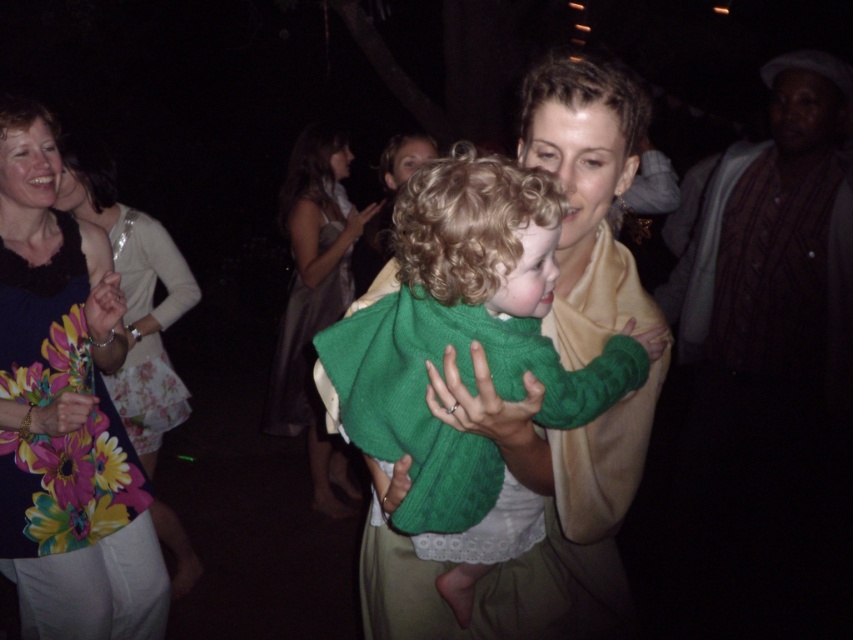
Between green knitted sweater at center and floral dress at left, which one appears on the right side from the viewer's perspective?

green knitted sweater at center is more to the right.

Is green knitted sweater at center positioned behind floral dress at left?

No, green knitted sweater at center is in front of floral dress at left.

Locate an element on the screen. The width and height of the screenshot is (853, 640). green knitted sweater at center is located at coordinates (467, 356).

Does floral dress at left appear under silky beige dress at center?

Correct, floral dress at left is located below silky beige dress at center.

Which of these two, floral dress at left or silky beige dress at center, stands shorter?

floral dress at left

Where is `floral dress at left`? floral dress at left is located at coordinates (65, 412).

Can you confirm if green knitted sweater at center is wider than silky beige dress at center?

Correct, the width of green knitted sweater at center exceeds that of silky beige dress at center.

Who is positioned more to the left, green knitted sweater at center or silky beige dress at center?

silky beige dress at center is more to the left.

Where is `green knitted sweater at center`? green knitted sweater at center is located at coordinates (467, 356).